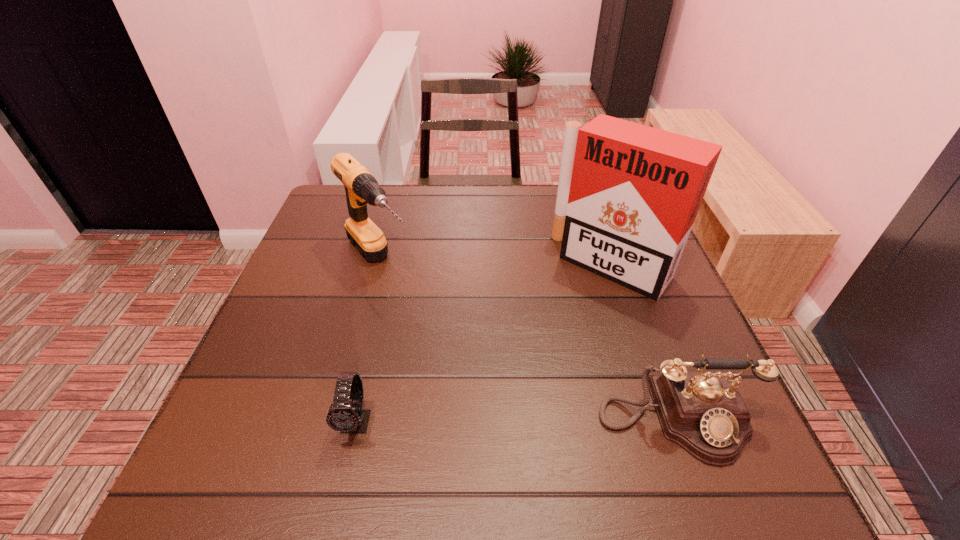
What are the coordinates of `free area in between the drill and the cigarette case` in the screenshot? It's located at (495, 263).

Identify the location of vacant space that is in between the tallest object and the watch. The image size is (960, 540). (485, 343).

Point out which object is positioned as the nearest to the third tallest object. Please provide its 2D coordinates. Your answer should be formatted as a tuple, i.e. [(x, y)], where the tuple contains the x and y coordinates of a point satisfying the conditions above.

[(628, 194)]

Identify which object is the third closest to the third shortest object. Please provide its 2D coordinates. Your answer should be formatted as a tuple, i.e. [(x, y)], where the tuple contains the x and y coordinates of a point satisfying the conditions above.

[(703, 412)]